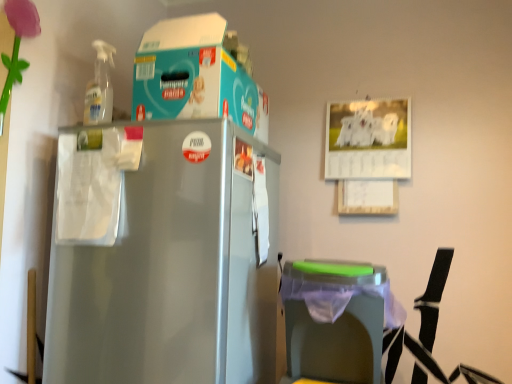
Question: From the image's perspective, is teal cardboard box at upper center above or below green plastic trash can at lower right?

Choices:
 (A) above
 (B) below

Answer: (A)

Question: In terms of width, does teal cardboard box at upper center look wider or thinner when compared to green plastic trash can at lower right?

Choices:
 (A) wide
 (B) thin

Answer: (A)

Question: From a real-world perspective, is teal cardboard box at upper center positioned above or below green plastic trash can at lower right?

Choices:
 (A) below
 (B) above

Answer: (B)

Question: Looking at their shapes, would you say green plastic trash can at lower right is wider or thinner than teal cardboard box at upper center?

Choices:
 (A) wide
 (B) thin

Answer: (B)

Question: Based on their sizes in the image, would you say green plastic trash can at lower right is bigger or smaller than teal cardboard box at upper center?

Choices:
 (A) big
 (B) small

Answer: (B)

Question: From the image's perspective, is green plastic trash can at lower right positioned above or below teal cardboard box at upper center?

Choices:
 (A) below
 (B) above

Answer: (A)

Question: From a real-world perspective, is green plastic trash can at lower right physically located above or below teal cardboard box at upper center?

Choices:
 (A) above
 (B) below

Answer: (B)